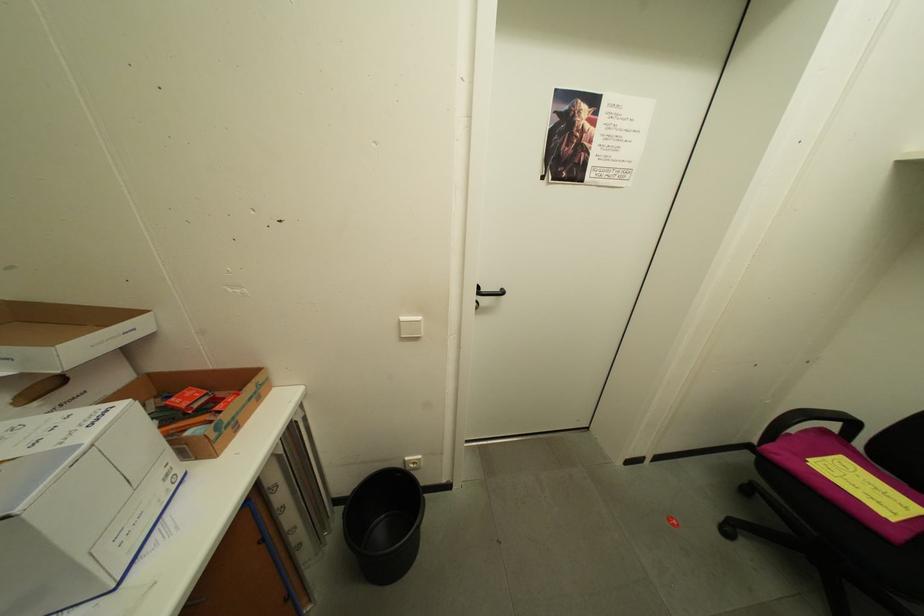
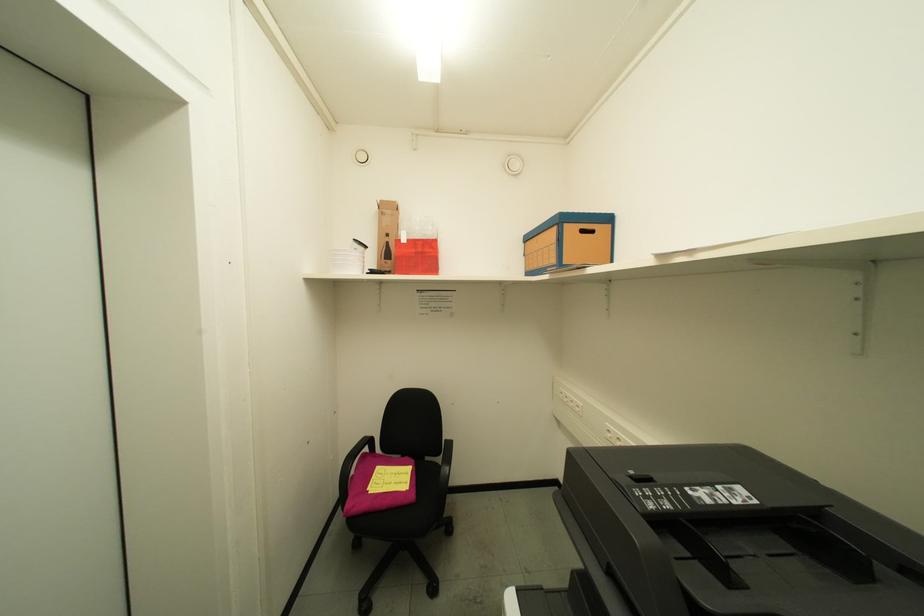
Question: The first image is from the beginning of the video and the second image is from the end. How did the camera likely rotate when shooting the video?

Choices:
 (A) Left
 (B) Right
 (C) Up
 (D) Down

Answer: (B)